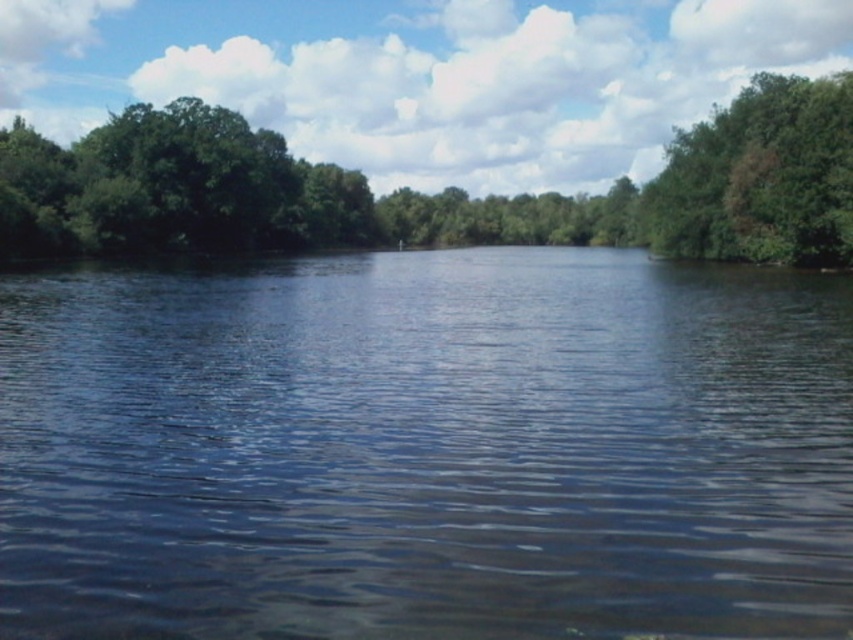
Does green leafy trees at left have a smaller size compared to green leafy tree at upper right?

No.

Can you confirm if green leafy trees at left is shorter than green leafy tree at upper right?

Incorrect, green leafy trees at left's height does not fall short of green leafy tree at upper right's.

Does point (715, 248) come farther from viewer compared to point (740, 102)?

No, (715, 248) is closer to viewer.

I want to click on green leafy trees at left, so click(437, 193).

Image resolution: width=853 pixels, height=640 pixels. Find the location of `transparent water at center`. transparent water at center is located at coordinates (426, 449).

Between point (518, 611) and point (796, 129), which one is positioned behind?

The point (796, 129) is more distant.

The width and height of the screenshot is (853, 640). What are the coordinates of `transparent water at center` in the screenshot? It's located at tap(426, 449).

Identify the location of transparent water at center. Image resolution: width=853 pixels, height=640 pixels. (426, 449).

Is transparent water at center in front of green leafy tree at upper right?

Yes, transparent water at center is in front of green leafy tree at upper right.

Which is behind, point (138, 451) or point (692, 164)?

The point (692, 164) is more distant.

Who is more forward, (283, 451) or (660, 221)?

Point (283, 451)

The image size is (853, 640). Identify the location of transparent water at center. (426, 449).